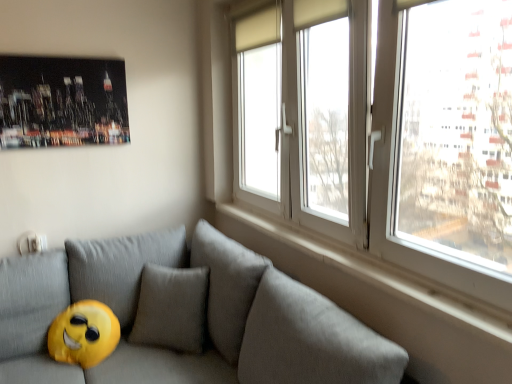
Question: Do you think white plastic window at upper right is within shiny metallic poster at upper left, or outside of it?

Choices:
 (A) outside
 (B) inside

Answer: (A)

Question: Is white plastic window at upper right taller or shorter than shiny metallic poster at upper left?

Choices:
 (A) tall
 (B) short

Answer: (A)

Question: Based on their relative distances, which object is farther from the gray fabric couch at lower left?

Choices:
 (A) white plastic window at upper right
 (B) white smooth window sill at upper right
 (C) shiny metallic poster at upper left

Answer: (C)

Question: Estimate the real-world distances between objects in this image. Which object is farther from the white plastic window at upper right?

Choices:
 (A) white smooth window sill at upper right
 (B) gray fabric couch at lower left
 (C) shiny metallic poster at upper left

Answer: (C)